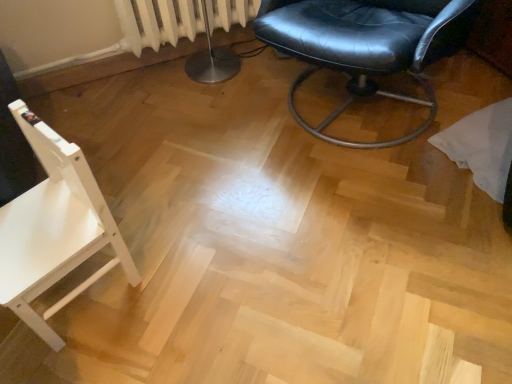
Question: Based on their sizes in the image, would you say black leather chair at center, the 1th chair when ordered from right to left, is bigger or smaller than white wood chair at left, arranged as the second chair when viewed from the top?

Choices:
 (A) small
 (B) big

Answer: (B)

Question: From a real-world perspective, relative to white wood chair at left, the first chair in the left-to-right sequence, is black leather chair at center, the second chair ordered from the bottom, vertically above or below?

Choices:
 (A) above
 (B) below

Answer: (A)

Question: Considering the real-world distances, which object is farthest from the black leather chair at center, the 1th chair when ordered from right to left?

Choices:
 (A) white wood chair at left, the first chair in the left-to-right sequence
 (B) white textured radiator at upper left

Answer: (A)

Question: Which object is the closest to the black leather chair at center, the 1th chair when ordered from right to left?

Choices:
 (A) white textured radiator at upper left
 (B) white wood chair at left, the first chair in the left-to-right sequence

Answer: (A)